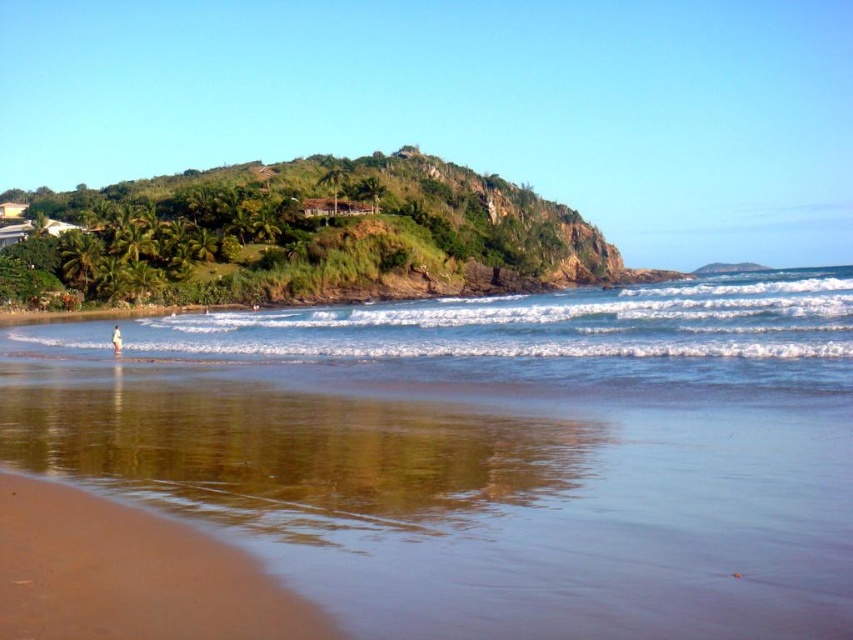
Is clear blue water at center above brown sandy beach at lower left?

Yes, clear blue water at center is above brown sandy beach at lower left.

Does clear blue water at center have a smaller size compared to brown sandy beach at lower left?

No, clear blue water at center is not smaller than brown sandy beach at lower left.

Is point (84, 326) behind point (234, 634)?

Yes.

This screenshot has width=853, height=640. What are the coordinates of `clear blue water at center` in the screenshot? It's located at (486, 451).

Is the position of clear blue water at center more distant than that of white sand at lower left?

No, clear blue water at center is in front of white sand at lower left.

Can you confirm if clear blue water at center is positioned above white sand at lower left?

Correct, clear blue water at center is located above white sand at lower left.

What do you see at coordinates (486, 451) in the screenshot? I see `clear blue water at center` at bounding box center [486, 451].

Find the location of a particular element. This screenshot has height=640, width=853. clear blue water at center is located at coordinates (486, 451).

Measure the distance between point [235,259] and camera.

They are 106.28 meters apart.

Is green grassy hill at upper center shorter than brown sandy beach at lower left?

No.

Who is more distant from viewer, (44, 292) or (236, 556)?

Point (44, 292)

In order to click on green grassy hill at upper center in this screenshot , I will do `click(300, 237)`.